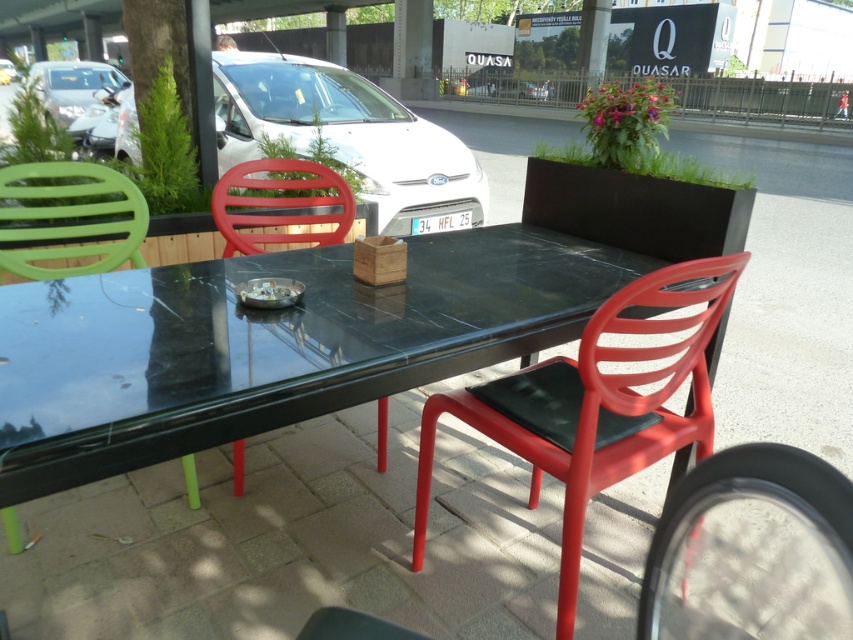
Question: In this image, where is red plastic chair at center located relative to metallic silver car at upper left?

Choices:
 (A) right
 (B) left

Answer: (A)

Question: Based on their relative distances, which object is farther from the green plastic chair at left?

Choices:
 (A) matte green chair at left
 (B) matte plastic chair at center
 (C) metallic silver car at upper left

Answer: (C)

Question: Which point is closer to the camera?

Choices:
 (A) (67, 339)
 (B) (50, 84)
 (C) (262, 164)
 (D) (16, 218)

Answer: (A)

Question: Which object appears closest to the camera in this image?

Choices:
 (A) white glossy car at upper center
 (B) metallic silver car at upper left
 (C) matte plastic chair at center
 (D) matte green chair at left

Answer: (D)

Question: Is green plastic chair at left positioned before matte plastic chair at center?

Choices:
 (A) yes
 (B) no

Answer: (A)

Question: Does green plastic chair at left have a greater width compared to matte plastic chair at center?

Choices:
 (A) no
 (B) yes

Answer: (A)